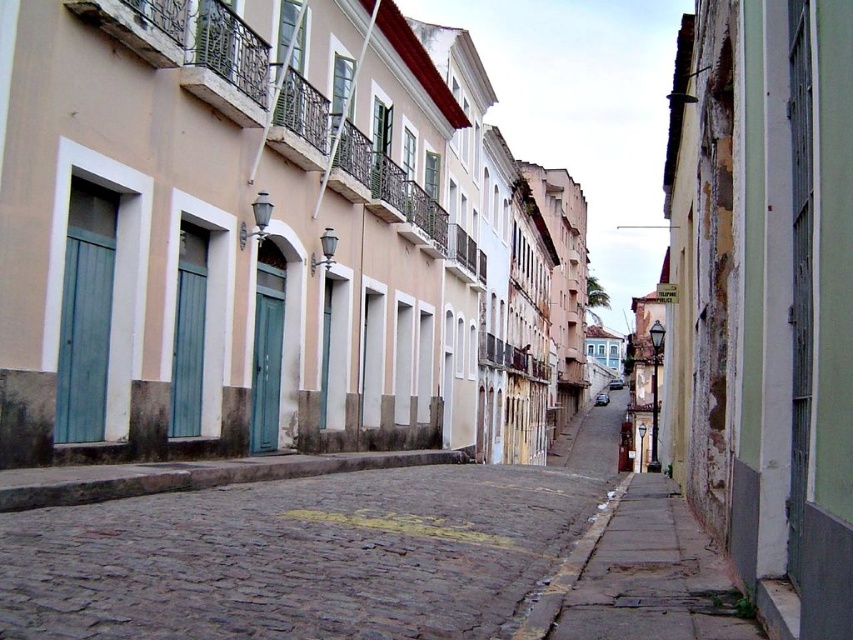
Can you confirm if brown cobblestone pavement at center is positioned below smooth concrete sidewalk at lower right?

Yes, brown cobblestone pavement at center is below smooth concrete sidewalk at lower right.

Is brown cobblestone pavement at center closer to the viewer compared to smooth concrete sidewalk at lower right?

Yes, it is in front of smooth concrete sidewalk at lower right.

Is point (506, 506) positioned before point (682, 632)?

No.

Where is `brown cobblestone pavement at center`? The width and height of the screenshot is (853, 640). brown cobblestone pavement at center is located at coordinates (299, 556).